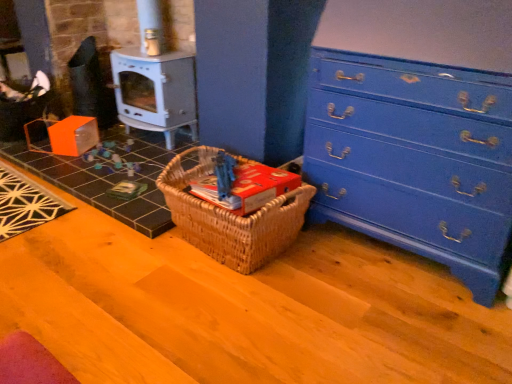
Question: From a real-world perspective, is blue painted wood chest of drawers at right positioned above or below orange cardboard box at lower left?

Choices:
 (A) above
 (B) below

Answer: (A)

Question: Considering the positions of blue painted wood chest of drawers at right and orange cardboard box at lower left in the image, is blue painted wood chest of drawers at right bigger or smaller than orange cardboard box at lower left?

Choices:
 (A) big
 (B) small

Answer: (A)

Question: Which object is positioned farthest from the red cardboard book at center?

Choices:
 (A) orange cardboard box at lower left
 (B) metallic gray stove at center left
 (C) blue painted wood chest of drawers at right
 (D) woven wood picnic basket at center

Answer: (B)

Question: Based on their relative distances, which object is nearer to the orange cardboard box at lower left?

Choices:
 (A) woven wood picnic basket at center
 (B) metallic gray stove at center left
 (C) blue painted wood chest of drawers at right
 (D) red cardboard book at center

Answer: (B)